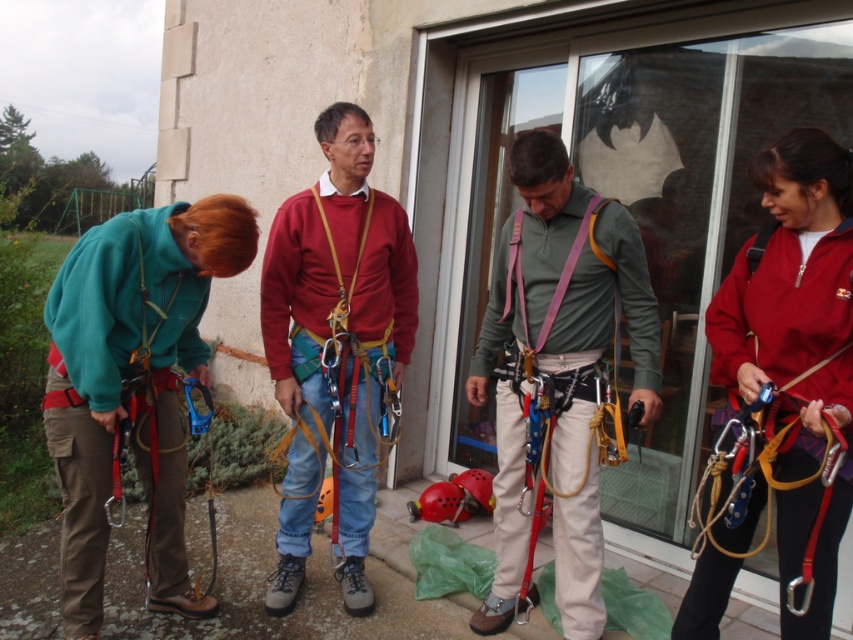
In the scene shown: Does teal fleece jacket at left have a lesser height compared to matte red sweater at center?

Yes, teal fleece jacket at left is shorter than matte red sweater at center.

Who is taller, teal fleece jacket at left or matte red sweater at center?

Standing taller between the two is matte red sweater at center.

Between point (177, 397) and point (309, 445), which one is positioned behind?

Point (309, 445)

Where is `teal fleece jacket at left`? The width and height of the screenshot is (853, 640). teal fleece jacket at left is located at coordinates (132, 385).

Does matte green shirt at center appear under purple fabric strap at center?

Correct, matte green shirt at center is located below purple fabric strap at center.

Is point (473, 364) in front of point (525, 298)?

No.

Locate an element on the screen. Image resolution: width=853 pixels, height=640 pixels. matte green shirt at center is located at coordinates (558, 372).

In order to click on matte green shirt at center in this screenshot , I will do `click(558, 372)`.

Is point (787, 547) positioned behind point (515, 230)?

That is False.

Which is behind, point (837, 376) or point (512, 228)?

The point (512, 228) is behind.

In order to click on red fleece jacket at right in this screenshot , I will do `click(796, 344)`.